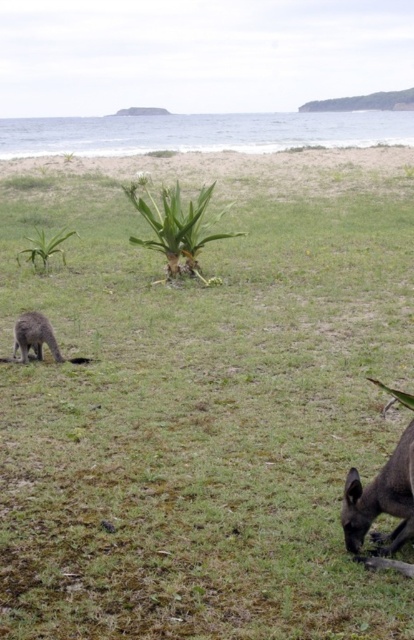
You are standing on the grassy area near the beach and see the brown furry kangaroo at lower right and the brown fur kangaroo at lower left. Which kangaroo is positioned lower in the frame?

The brown furry kangaroo at lower right is positioned lower in the frame than the brown fur kangaroo at lower left.

You are standing at the edge of the grassy area near the beach and want to take a photo of the brown furry kangaroo at lower right. If your camera has a maximum focus range of 3 meters, will you need to move closer to capture a clear photo?

The brown furry kangaroo at lower right is 3.75 meters away from the camera. Since the camera can only focus up to 3 meters, you need to move closer to ensure the kangaroo is within the focus range.

You are a wildlife photographer standing at the center of the grassy area. You want to capture a photo of both the brown furry kangaroo at lower right and the brown fur kangaroo at lower left in the same frame. Given that your camera has a maximum focal length allowing a 10 feet field of view, will you be able to include both kangaroos in the photo?

The distance between the brown furry kangaroo at lower right and the brown fur kangaroo at lower left is 12.99 feet. Since the camera can only capture a 10 feet field of view, the two kangaroos are too far apart to fit in the same photo.